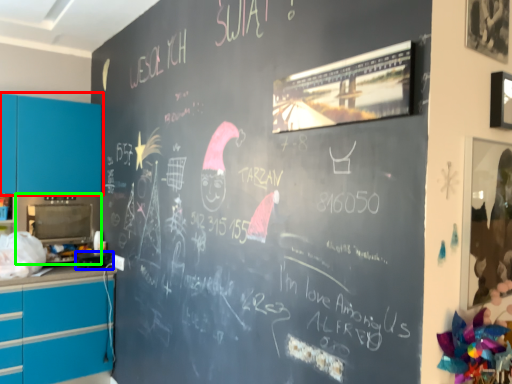
Question: Estimate the real-world distances between objects in this image. Which object is farther from cabinetry (highlighted by a red box), appliance (highlighted by a blue box) or appliance (highlighted by a green box)?

Choices:
 (A) appliance
 (B) appliance

Answer: (A)